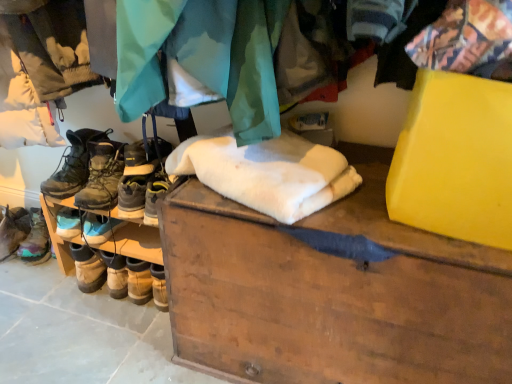
What do you see at coordinates (89, 170) in the screenshot? This screenshot has height=384, width=512. I see `leather hiking boots at left, which is counted as the 2th footwear, starting from the right` at bounding box center [89, 170].

The image size is (512, 384). What do you see at coordinates (73, 164) in the screenshot? I see `leather boots at left, acting as the third footwear starting from the right` at bounding box center [73, 164].

The width and height of the screenshot is (512, 384). I want to click on wooden chest at center, so click(332, 292).

Describe the element at coordinates (332, 292) in the screenshot. I see `wooden chest at center` at that location.

The width and height of the screenshot is (512, 384). Identify the location of leather boots at left, arranged as the first footwear when viewed from the left. (25, 236).

From the image's perspective, which is above, leather boots at left, marked as the 2th footwear in a left-to-right arrangement, or wooden chest at center?

leather boots at left, marked as the 2th footwear in a left-to-right arrangement, is shown above in the image.

From the picture: Between leather boots at left, acting as the third footwear starting from the right, and wooden chest at center, which one appears on the left side from the viewer's perspective?

leather boots at left, acting as the third footwear starting from the right.

Is leather boots at left, acting as the third footwear starting from the right, wider or thinner than wooden chest at center?

leather boots at left, acting as the third footwear starting from the right, is thinner than wooden chest at center.

Is leather boots at left, marked as the 2th footwear in a left-to-right arrangement, situated inside wooden chest at center or outside?

leather boots at left, marked as the 2th footwear in a left-to-right arrangement, exists outside the volume of wooden chest at center.

Looking at this image, can you confirm if white fluffy blanket at center is bigger than leather hiking boots at left, the 3th footwear positioned from the left?

Indeed, white fluffy blanket at center has a larger size compared to leather hiking boots at left, the 3th footwear positioned from the left.

At what (x,y) coordinates should I click in order to perform the action: click on blanket above the leather hiking boots at left, which is counted as the 2th footwear, starting from the right (from the image's perspective). Please return your answer as a coordinate pair (x, y). This screenshot has height=384, width=512. Looking at the image, I should click on (267, 172).

Can you confirm if white fluffy blanket at center is taller than leather hiking boots at left, which is counted as the 2th footwear, starting from the right?

Incorrect, the height of white fluffy blanket at center is not larger of that of leather hiking boots at left, which is counted as the 2th footwear, starting from the right.

From a real-world perspective, is white fluffy blanket at center above or below leather hiking boots at left, the 3th footwear positioned from the left?

white fluffy blanket at center is situated higher than leather hiking boots at left, the 3th footwear positioned from the left, in the real world.

Considering the positions of objects leather hiking boots at center, placed as the 1th footwear when sorted from right to left, and wooden chest at center in the image provided, who is more to the left, leather hiking boots at center, placed as the 1th footwear when sorted from right to left, or wooden chest at center?

Positioned to the left is leather hiking boots at center, placed as the 1th footwear when sorted from right to left.

Is leather hiking boots at center, placed as the 1th footwear when sorted from right to left, next to wooden chest at center?

No.

Considering their positions, is leather hiking boots at center, which is the fourth footwear in left-to-right order, located in front of or behind wooden chest at center?

leather hiking boots at center, which is the fourth footwear in left-to-right order, is behind wooden chest at center.

In the scene shown: Is leather boots at left, acting as the third footwear starting from the right, directly adjacent to leather hiking boots at left, which is counted as the 2th footwear, starting from the right?

Yes, leather boots at left, acting as the third footwear starting from the right, is with leather hiking boots at left, which is counted as the 2th footwear, starting from the right.

Does point (61, 171) lie in front of point (111, 206)?

No.

Is leather hiking boots at left, which is counted as the 2th footwear, starting from the right, at the back of leather boots at left, acting as the third footwear starting from the right?

No, leather boots at left, acting as the third footwear starting from the right, is not facing the opposite direction of leather hiking boots at left, which is counted as the 2th footwear, starting from the right.

Is leather boots at left, marked as the 2th footwear in a left-to-right arrangement, bigger than leather hiking boots at left, the 3th footwear positioned from the left?

No, leather boots at left, marked as the 2th footwear in a left-to-right arrangement, is not bigger than leather hiking boots at left, the 3th footwear positioned from the left.

Which is more to the right, leather hiking boots at center, which is the fourth footwear in left-to-right order, or leather boots at left, arranged as the first footwear when viewed from the left?

Positioned to the right is leather hiking boots at center, which is the fourth footwear in left-to-right order.

Is leather hiking boots at center, which is the fourth footwear in left-to-right order, bigger or smaller than leather boots at left, arranged as the first footwear when viewed from the left?

Considering their sizes, leather hiking boots at center, which is the fourth footwear in left-to-right order, takes up less space than leather boots at left, arranged as the first footwear when viewed from the left.

Is leather hiking boots at center, placed as the 1th footwear when sorted from right to left, positioned beyond the bounds of leather boots at left, acting as the 4th footwear starting from the right?

leather hiking boots at center, placed as the 1th footwear when sorted from right to left, is positioned outside leather boots at left, acting as the 4th footwear starting from the right.

From a real-world perspective, is leather hiking boots at left, the 3th footwear positioned from the left, positioned above or below white fluffy blanket at center?

leather hiking boots at left, the 3th footwear positioned from the left, is situated lower than white fluffy blanket at center in the real world.

Is leather hiking boots at left, the 3th footwear positioned from the left, far away from white fluffy blanket at center?

No, leather hiking boots at left, the 3th footwear positioned from the left, is not far from white fluffy blanket at center.

From the image's perspective, who appears lower, leather hiking boots at left, which is counted as the 2th footwear, starting from the right, or white fluffy blanket at center?

leather hiking boots at left, which is counted as the 2th footwear, starting from the right, is shown below in the image.

Does leather boots at left, acting as the 4th footwear starting from the right, have a larger size compared to white fluffy blanket at center?

Actually, leather boots at left, acting as the 4th footwear starting from the right, might be smaller than white fluffy blanket at center.

From the image's perspective, is leather boots at left, acting as the 4th footwear starting from the right, positioned above or below white fluffy blanket at center?

leather boots at left, acting as the 4th footwear starting from the right, is below white fluffy blanket at center.

This screenshot has width=512, height=384. I want to click on the 4th footwear below the white fluffy blanket at center (from a real-world perspective), so click(x=25, y=236).

Is leather boots at left, acting as the 4th footwear starting from the right, wider than white fluffy blanket at center?

Incorrect, the width of leather boots at left, acting as the 4th footwear starting from the right, does not surpass that of white fluffy blanket at center.

Locate an element on the screen. Image resolution: width=512 pixels, height=384 pixels. cabinetry below the leather boots at left, acting as the third footwear starting from the right (from the image's perspective) is located at coordinates (332, 292).

Find the location of `the 1st footwear behind the white fluffy blanket at center, starting your count from the anchor`. the 1st footwear behind the white fluffy blanket at center, starting your count from the anchor is located at coordinates (89, 170).

Estimate the real-world distances between objects in this image. Which object is further from white fluffy blanket at center, leather boots at left, marked as the 2th footwear in a left-to-right arrangement, or leather hiking boots at center, which is the fourth footwear in left-to-right order?

The object further to white fluffy blanket at center is leather boots at left, marked as the 2th footwear in a left-to-right arrangement.

Estimate the real-world distances between objects in this image. Which object is closer to white fluffy blanket at center, leather hiking boots at left, the 3th footwear positioned from the left, or leather boots at left, acting as the 4th footwear starting from the right?

leather hiking boots at left, the 3th footwear positioned from the left, is closer to white fluffy blanket at center.

Which object lies further to the anchor point white fluffy blanket at center, leather hiking boots at center, placed as the 1th footwear when sorted from right to left, or wooden chest at center?

Based on the image, leather hiking boots at center, placed as the 1th footwear when sorted from right to left, appears to be further to white fluffy blanket at center.

Estimate the real-world distances between objects in this image. Which object is further from leather boots at left, acting as the third footwear starting from the right, wooden chest at center or leather hiking boots at left, which is counted as the 2th footwear, starting from the right?

Among the two, wooden chest at center is located further to leather boots at left, acting as the third footwear starting from the right.

Which object lies further to the anchor point white fluffy blanket at center, leather hiking boots at center, which is the fourth footwear in left-to-right order, or leather boots at left, acting as the 4th footwear starting from the right?

Based on the image, leather boots at left, acting as the 4th footwear starting from the right, appears to be further to white fluffy blanket at center.

Looking at the image, which one is located further to leather boots at left, acting as the 4th footwear starting from the right, leather hiking boots at left, which is counted as the 2th footwear, starting from the right, or white fluffy blanket at center?

Among the two, white fluffy blanket at center is located further to leather boots at left, acting as the 4th footwear starting from the right.

Considering their positions, is white fluffy blanket at center positioned further to leather hiking boots at left, which is counted as the 2th footwear, starting from the right, than leather boots at left, arranged as the first footwear when viewed from the left?

white fluffy blanket at center is positioned further to the anchor leather hiking boots at left, which is counted as the 2th footwear, starting from the right.

In the scene shown: Which object lies nearer to the anchor point leather boots at left, acting as the third footwear starting from the right, leather hiking boots at left, which is counted as the 2th footwear, starting from the right, or white fluffy blanket at center?

leather hiking boots at left, which is counted as the 2th footwear, starting from the right.

I want to click on footwear between leather hiking boots at left, the 3th footwear positioned from the left, and wooden chest at center, so click(x=140, y=174).

Locate an element on the screen. blanket situated between leather hiking boots at left, the 3th footwear positioned from the left, and wooden chest at center from left to right is located at coordinates (267, 172).

This screenshot has height=384, width=512. Identify the location of blanket situated between leather boots at left, arranged as the first footwear when viewed from the left, and wooden chest at center from left to right. (267, 172).

Locate an element on the screen. This screenshot has height=384, width=512. footwear between leather boots at left, acting as the 4th footwear starting from the right, and leather hiking boots at left, the 3th footwear positioned from the left is located at coordinates (73, 164).